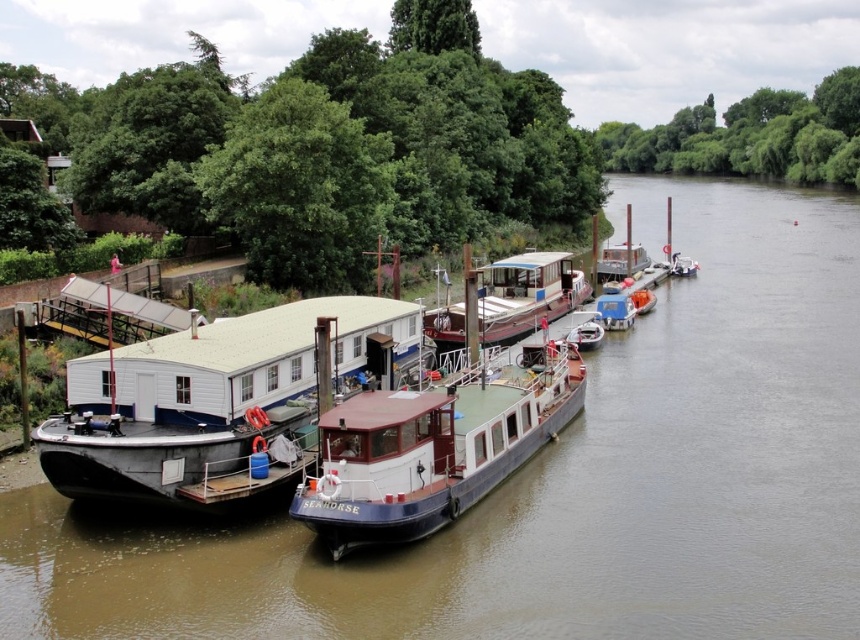
Question: Which object appears closest to the camera in this image?

Choices:
 (A) white glossy houseboat at center
 (B) metallic gray barge at center

Answer: (A)

Question: Is dark blue polished wood boat at center behind white wooden houseboat at center?

Choices:
 (A) yes
 (B) no

Answer: (B)

Question: Among these objects, which one is nearest to the camera?

Choices:
 (A) blue plastic boat at center
 (B) metallic red boat at center

Answer: (A)

Question: Does dark blue polished wood boat at center come in front of metallic red boat at center?

Choices:
 (A) no
 (B) yes

Answer: (B)

Question: Which point is closer to the camera taking this photo?

Choices:
 (A) (336, 456)
 (B) (690, 625)
 (C) (437, 332)
 (D) (618, 310)

Answer: (B)

Question: Can you confirm if white matte houseboat at center is bigger than blue plastic boat at center?

Choices:
 (A) no
 (B) yes

Answer: (B)